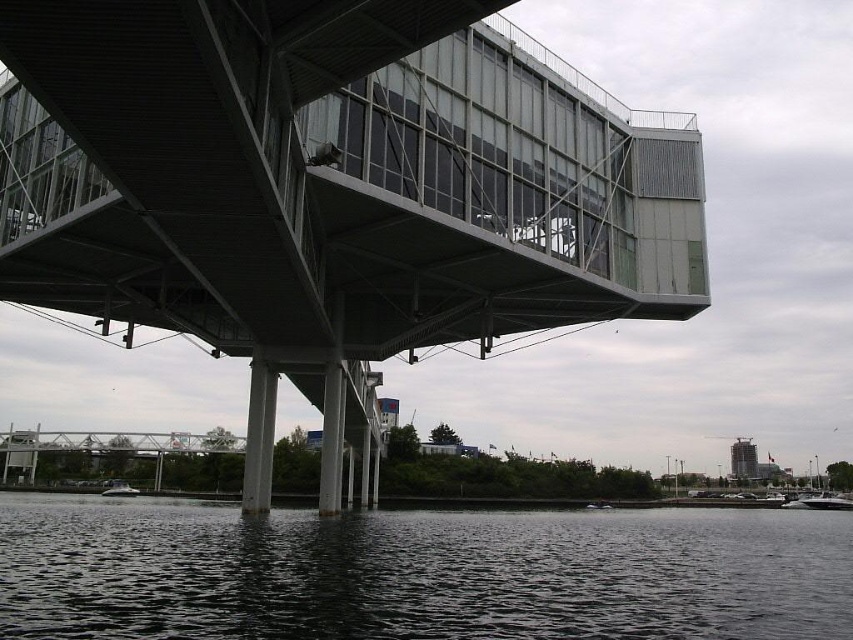
You are an architect designing a new walkway for the structure. The walkway must connect the metallic gray bridge at upper center to the dark water at lower center. Considering their spatial relationship, which object will require more adjustments to accommodate the walkway?

The metallic gray bridge at upper center will require more adjustments because it occupies less space than the dark water at lower center, so modifying its structure would be necessary to fit the walkway.

You are a visitor standing on the floating platform and want to take a photo of the white glossy boat at lower left and dark water at lower center. Which object will appear larger in the photo?

The dark water at lower center will appear larger in the photo because it is much taller than the white glossy boat at lower left.

You are standing on the metallic gray bridge at upper center in the image. You notice a point marked at coordinates (x=329, y=189). Where exactly is this point located relative to the bridge?

The point at coordinates (x=329, y=189) is located on the metallic gray bridge at upper center.